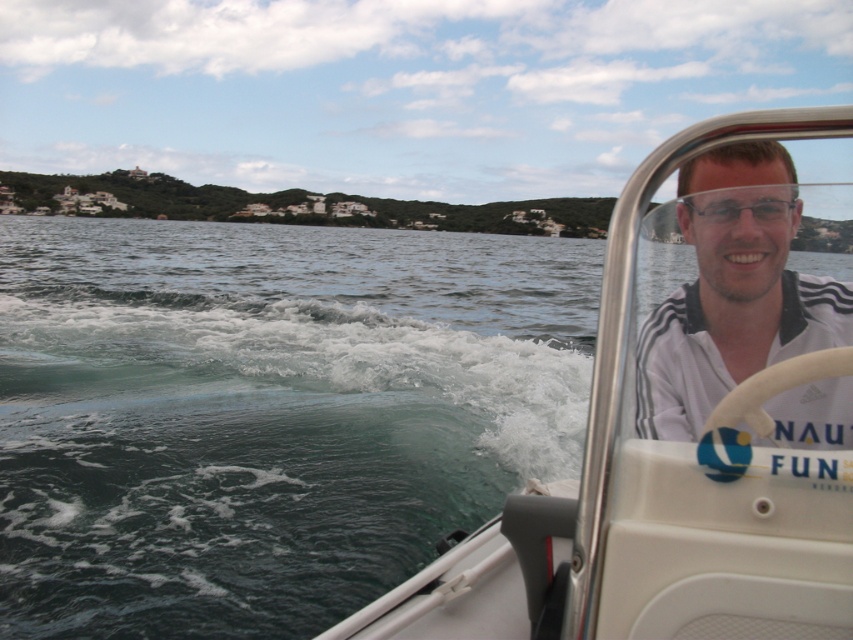
Question: Does white frothy water at lower left appear on the right side of clear plastic goggles at upper center?

Choices:
 (A) yes
 (B) no

Answer: (B)

Question: Does white frothy water at lower left have a greater width compared to clear plastic goggles at upper center?

Choices:
 (A) yes
 (B) no

Answer: (A)

Question: Which point is farther to the camera?

Choices:
 (A) (706, 365)
 (B) (450, 397)

Answer: (B)

Question: Estimate the real-world distances between objects in this image. Which object is farther from the white adidas shirt at center?

Choices:
 (A) clear plastic goggles at upper center
 (B) white plastic boat at right

Answer: (B)

Question: Estimate the real-world distances between objects in this image. Which object is farther from the white frothy water at lower left?

Choices:
 (A) white plastic boat at right
 (B) white adidas shirt at center

Answer: (B)

Question: Does white frothy water at lower left have a smaller size compared to clear plastic goggles at upper center?

Choices:
 (A) no
 (B) yes

Answer: (A)